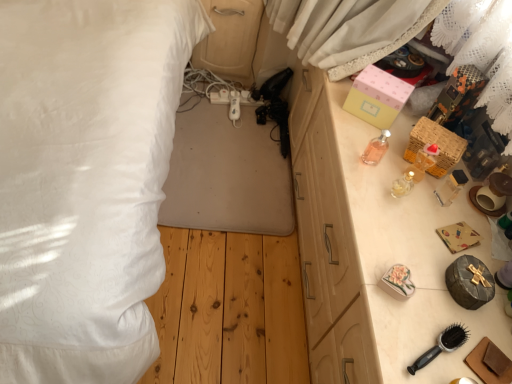
Question: From a real-world perspective, is woven wicker basket at right, arranged as the first box when ordered from the bottom, physically located above or below wooden drawer at right?

Choices:
 (A) above
 (B) below

Answer: (A)

Question: Does point (463, 147) appear closer or farther from the camera than point (440, 241)?

Choices:
 (A) closer
 (B) farther

Answer: (B)

Question: Which object is the farthest from the black plastic hairbrush at lower right?

Choices:
 (A) white fabric bed at left
 (B) pink paper box at upper right, which ranks as the 1th box in top-to-bottom order
 (C) woven wicker basket at right, arranged as the first box when ordered from the bottom
 (D) matte wood dresser at center
 (E) pink glass perfume at upper right

Answer: (D)

Question: Which object is the closest to the black plastic hairbrush at lower right?

Choices:
 (A) woven wicker basket at right, marked as the second box in a top-to-bottom arrangement
 (B) pink glass perfume at upper right
 (C) wooden drawer at right
 (D) white fabric bed at left
 (E) pink paper box at upper right, which is the second box from bottom to top

Answer: (C)